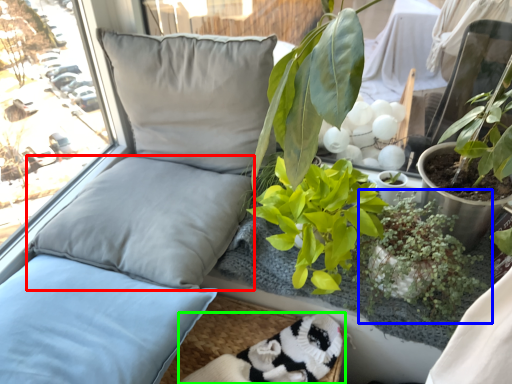
Question: Which object is positioned closest to pillow (highlighted by a red box)? Select from houseplant (highlighted by a blue box) and wide (highlighted by a green box).

Choices:
 (A) houseplant
 (B) wide

Answer: (B)